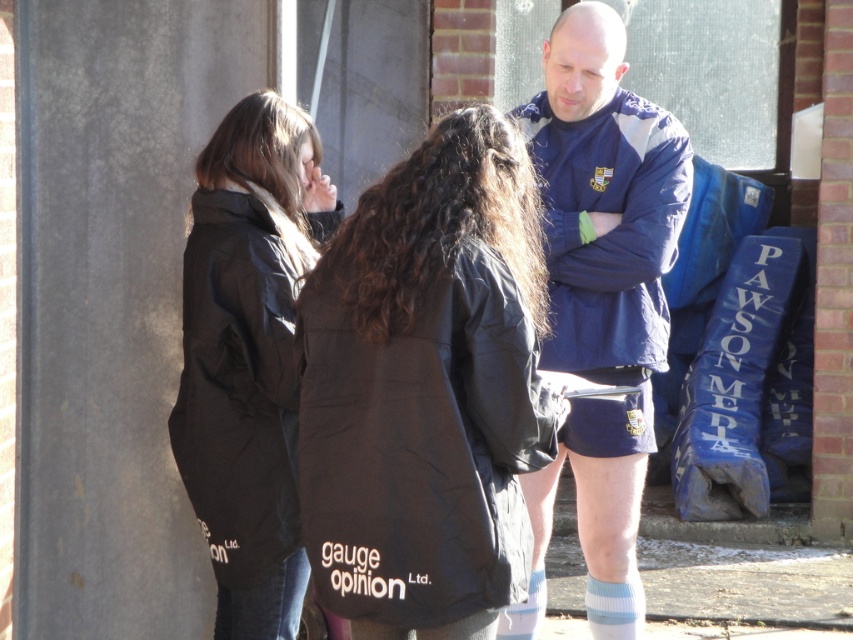
You are a photographer trying to capture a group photo of the blue jersey at center and the white knit sock at lower center. If you want to frame both subjects in the same shot without moving them, which one should you focus on to ensure both are visible?

You should focus on the blue jersey at center because it might be wider than the white knit sock at lower center, allowing both to fit within the frame when centered on the wider subject.

You are a photographer trying to capture a closeup of the blue jersey at center and the white knit sock at lower center. Since you can only focus on one object at a time, which one should you choose to ensure it appears sharp in the photo?

The blue jersey at center is taller than the white knit sock at lower center, so focusing on the blue jersey at center would ensure it appears sharp as it is larger in the frame.

You are a photographer trying to capture a candid shot of the blue jersey at center and the light blue knit sock at lower center. To ensure both are in frame, you need to adjust your camera angle. Which direction should you move your camera to include both objects?

You should move your camera to the right to include both the blue jersey at center and the light blue knit sock at lower center since the blue jersey at center is to the left of the light blue knit sock at lower center.